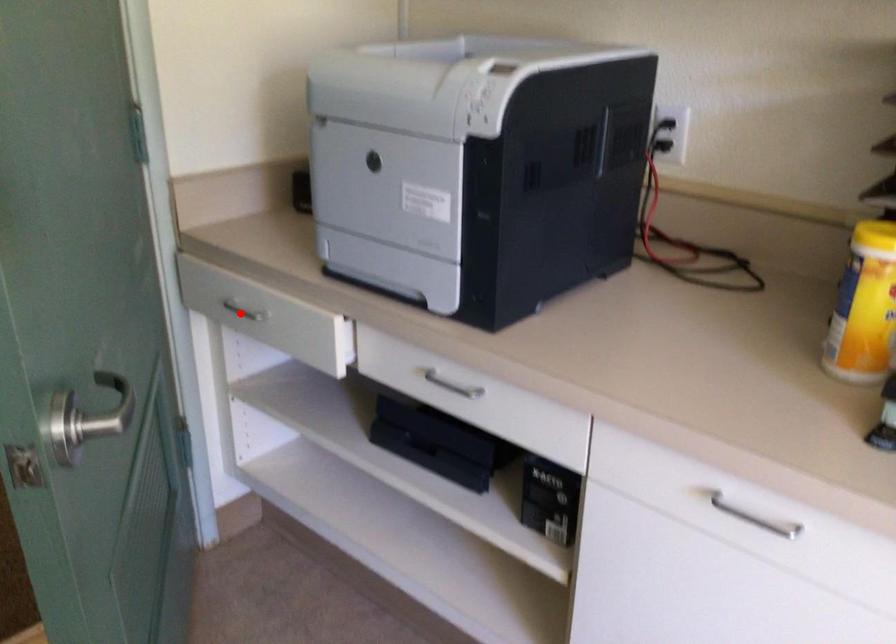
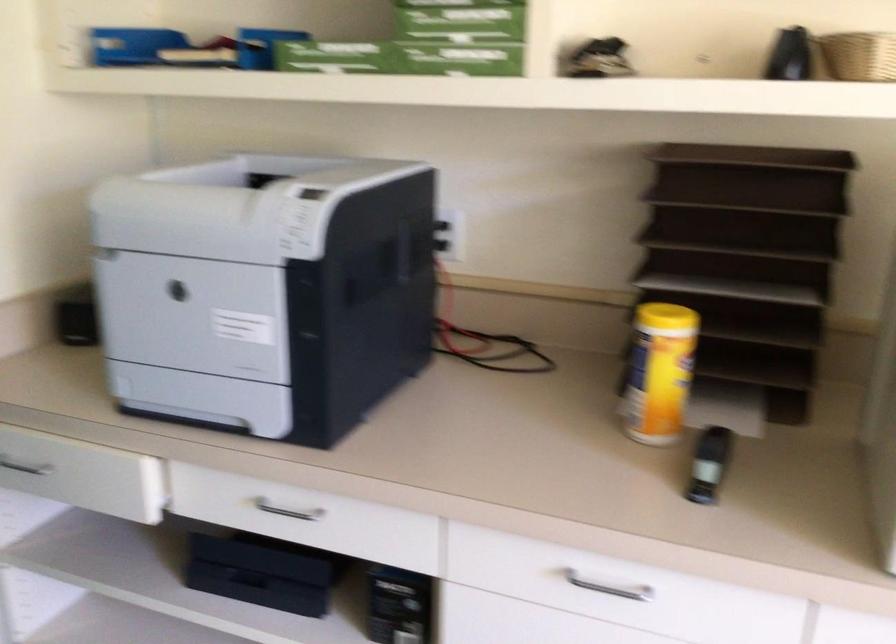
Locate, in the second image, the point that corresponds to the highlighted location in the first image.

(24, 467)